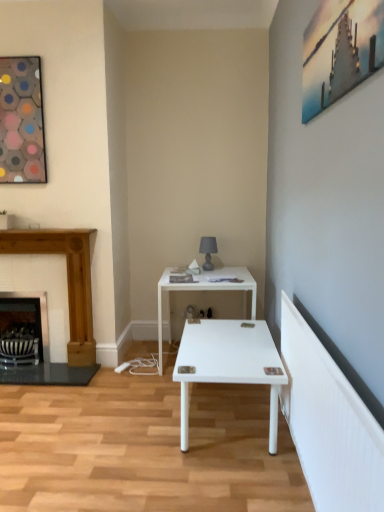
This screenshot has width=384, height=512. Identify the location of vacant space to the right of wooden fireplace at left, which ranks as the 1th fireplace in right-to-left order. (129, 369).